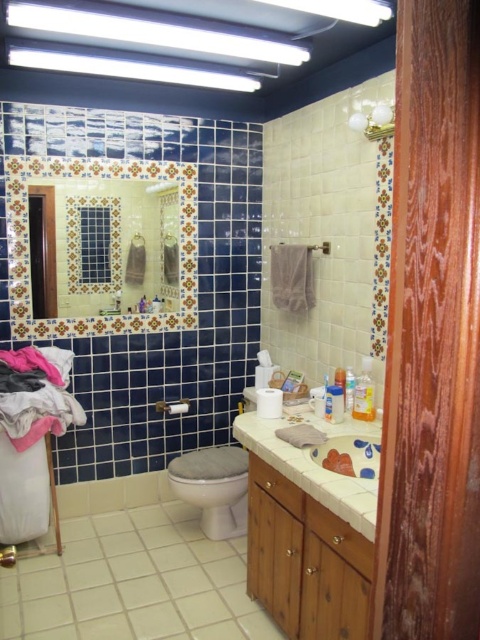
Question: Can you confirm if wooden cabinet at lower center is thinner than translucent plastic soap dispenser at center?

Choices:
 (A) no
 (B) yes

Answer: (A)

Question: Is the position of translucent plastic soap at center less distant than that of translucent plastic soap dispenser at upper center?

Choices:
 (A) no
 (B) yes

Answer: (B)

Question: Which object is positioned farthest from the translucent plastic soap dispenser at center?

Choices:
 (A) wooden cabinet at lower center
 (B) translucent plastic soap dispenser at upper center
 (C) translucent plastic soap at center

Answer: (A)

Question: Which object is closer to the camera taking this photo?

Choices:
 (A) translucent plastic soap dispenser at center
 (B) wooden cabinet at lower center
 (C) white glossy toilet at center
 (D) translucent plastic soap dispenser at upper center

Answer: (B)

Question: Which of the following is the closest to the observer?

Choices:
 (A) (202, 506)
 (B) (360, 412)
 (C) (342, 392)

Answer: (C)

Question: Can you confirm if translucent plastic soap dispenser at upper center is positioned to the right of translucent plastic soap dispenser at center?

Choices:
 (A) no
 (B) yes

Answer: (B)